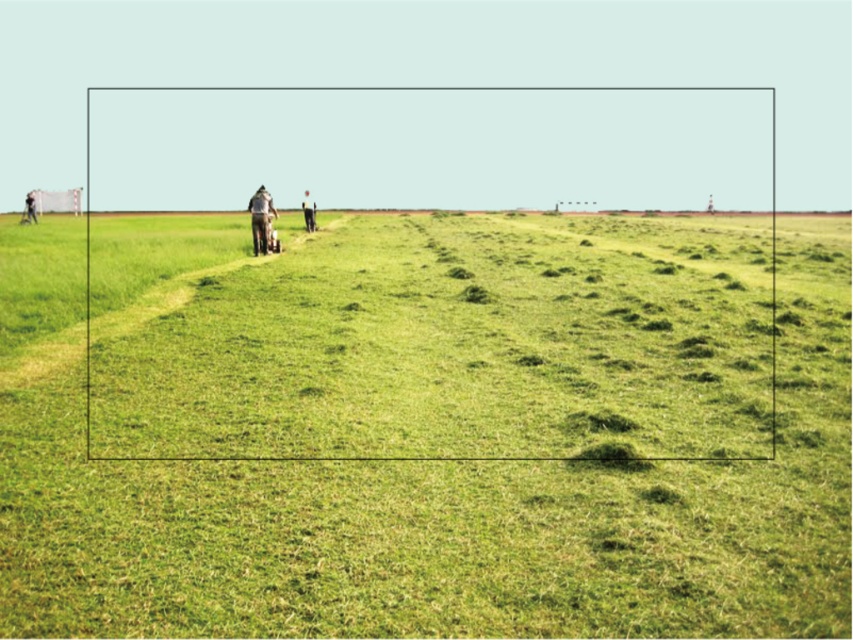
You are standing on the green grass at center and want to walk towards the smooth skin person at left. Which direction should you move in?

You should move upwards because the green grass at center is located below the smooth skin person at left.

You are standing on the green grass at center and looking at the light brown fabric jacket at center. Which object is taller?

The green grass at center is taller than the light brown fabric jacket at center.